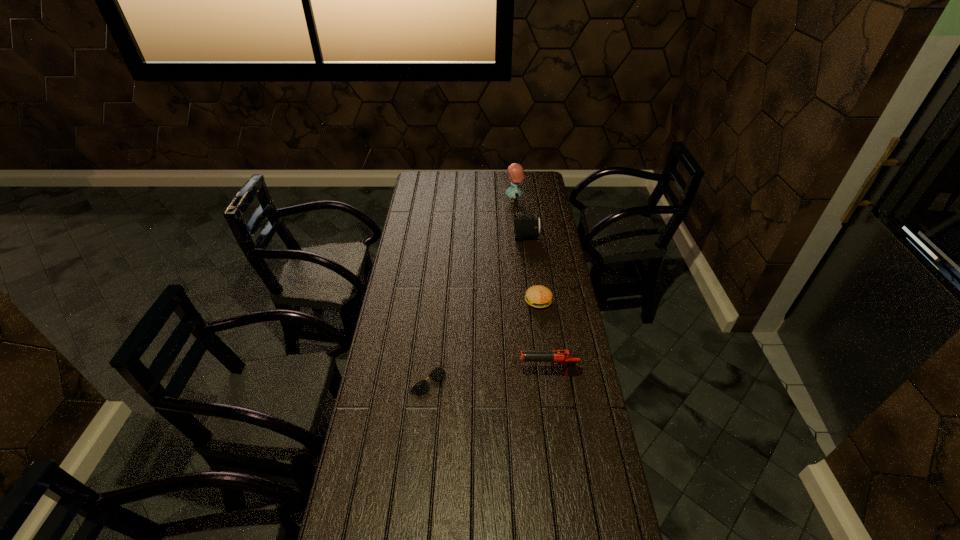
The width and height of the screenshot is (960, 540). I want to click on vacant space in between the telephoto lens and the fourth tallest object, so click(x=533, y=269).

This screenshot has height=540, width=960. In order to click on free area in between the tallest object and the spectacles in this screenshot , I will do `click(471, 291)`.

Where is `blank region between the telephoto lens and the leftmost object`? blank region between the telephoto lens and the leftmost object is located at coordinates (477, 309).

The width and height of the screenshot is (960, 540). Identify the location of empty space that is in between the gun and the fourth tallest object. (543, 338).

Identify the location of blank region between the spectacles and the fourth tallest object. Image resolution: width=960 pixels, height=540 pixels. (483, 341).

Locate an element on the screen. unoccupied position between the farthest object and the second shortest object is located at coordinates (526, 251).

Identify the location of the closest object to the telephoto lens. (516, 173).

Identify which object is the fourth closest to the leftmost object. Please provide its 2D coordinates. Your answer should be formatted as a tuple, i.e. [(x, y)], where the tuple contains the x and y coordinates of a point satisfying the conditions above.

[(516, 173)]

The height and width of the screenshot is (540, 960). I want to click on free space that satisfies the following two spatial constraints: 1. on the front-facing side of the patty; 2. on the left side of the farthest object, so click(524, 301).

The height and width of the screenshot is (540, 960). What are the coordinates of `free space that satisfies the following two spatial constraints: 1. at the front element of the fourth nearest object; 2. on the back side of the third farthest object` in the screenshot? It's located at [535, 301].